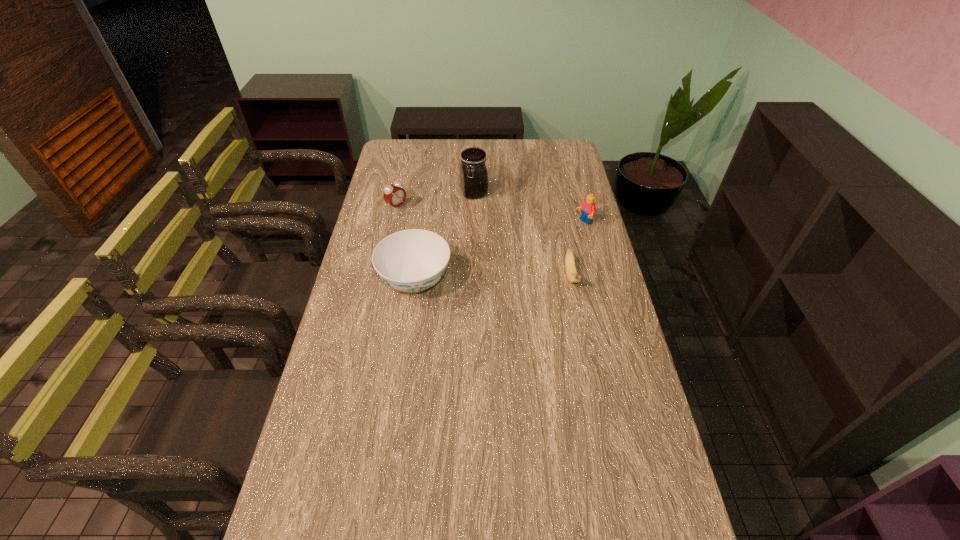
The width and height of the screenshot is (960, 540). What are the coordinates of `vacant space situated on the clock face of the alarm clock` in the screenshot? It's located at (474, 257).

Where is `blank area located on the clock face of the alarm clock`? This screenshot has height=540, width=960. blank area located on the clock face of the alarm clock is located at coordinates (461, 248).

Locate an element on the screen. The width and height of the screenshot is (960, 540). free space located 0.290m on the clock face of the alarm clock is located at coordinates 453,244.

Find the location of a particular element. This screenshot has height=540, width=960. free region located 0.210m on the lid of the jar is located at coordinates [x=492, y=235].

In order to click on vacant space located on the lid of the jar in this screenshot , I will do `click(492, 235)`.

You are a GUI agent. You are given a task and a screenshot of the screen. Output one action in this format:
    pyautogui.click(x=<x>, y=<y>)
    Task: Click on the vacant area situated 0.130m on the lid of the jar
    The width and height of the screenshot is (960, 540).
    Given the screenshot: What is the action you would take?
    pyautogui.click(x=486, y=222)

This screenshot has width=960, height=540. Find the location of `free region located on the face of the Lego`. free region located on the face of the Lego is located at coordinates (509, 264).

You are a GUI agent. You are given a task and a screenshot of the screen. Output one action in this format:
    pyautogui.click(x=<x>, y=<y>)
    Task: Click on the free space located on the face of the Lego
    Image resolution: width=960 pixels, height=540 pixels.
    Given the screenshot: What is the action you would take?
    pyautogui.click(x=560, y=236)

Locate an element on the screen. The height and width of the screenshot is (540, 960). vacant space positioned 0.160m on the face of the Lego is located at coordinates (548, 242).

At what (x,y) coordinates should I click in order to perform the action: click on chinaware that is at the left edge. Please return your answer as a coordinate pair (x, y). This screenshot has height=540, width=960. Looking at the image, I should click on (413, 260).